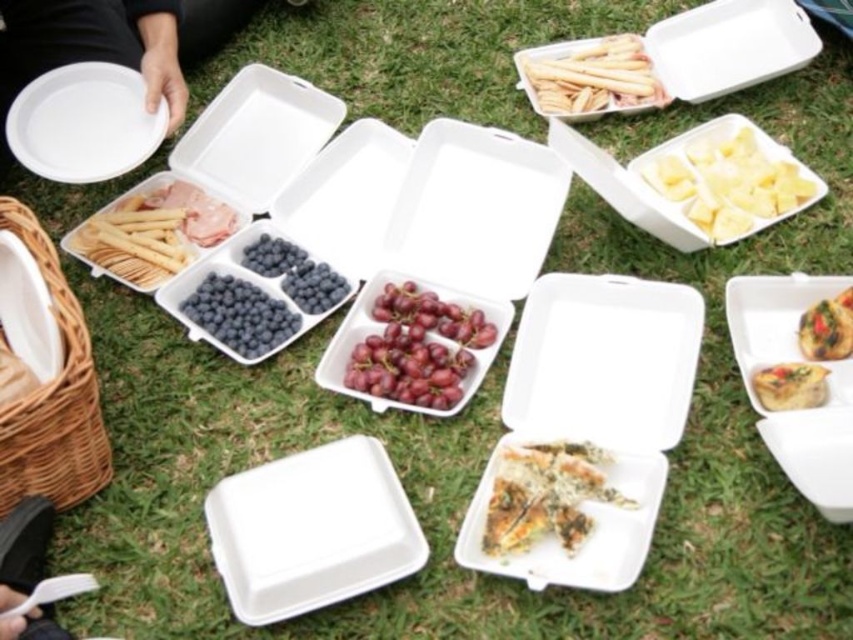
You are standing at the picnic area and want to pick up both items located at point (102, 256) and point (28, 580). Which item should you reach for first to minimize the distance you have to move your hand?

You should reach for the item at point (102, 256) first because it is closer to you than the item at point (28, 580), which is further away.

You are a picnic attendee who wants to grab both the yellow matte pineapple at upper right and the golden crispy quiche at center. If you can only reach 28 inches, can you reach both items without moving your position?

The yellow matte pineapple at upper right is 28.84 inches from the golden crispy quiche at center. Since your reach is 28 inches, you cannot reach both items without moving your position because the distance between them exceeds your reach.